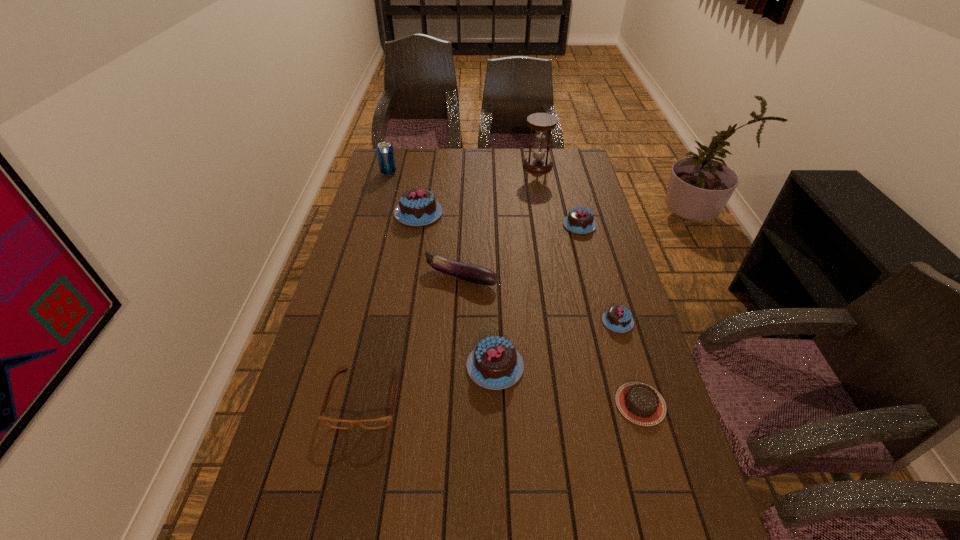
Locate an element on the screen. vacant space located 0.330m on the front of the fifth nearest object is located at coordinates (456, 384).

At what (x,y) coordinates should I click in order to perform the action: click on blank space located 0.200m on the front-facing side of the brown spectacles. Please return your answer as a coordinate pair (x, y). Looking at the image, I should click on (338, 527).

The height and width of the screenshot is (540, 960). I want to click on free point located 0.210m on the left of the third farthest chocolate cake, so click(x=529, y=321).

Find the location of a particular element. This screenshot has width=960, height=540. vacant space located 0.150m on the front of the shortest object is located at coordinates (666, 494).

This screenshot has width=960, height=540. Find the location of `hourglass that is at the far edge`. hourglass that is at the far edge is located at coordinates (541, 122).

Where is `beer can that is at the far edge`? The width and height of the screenshot is (960, 540). beer can that is at the far edge is located at coordinates (385, 153).

Where is `beer can that is positioned at the left edge`? This screenshot has width=960, height=540. beer can that is positioned at the left edge is located at coordinates (385, 153).

Where is `chocolate cake that is at the left edge`? This screenshot has height=540, width=960. chocolate cake that is at the left edge is located at coordinates (417, 207).

You are a GUI agent. You are given a task and a screenshot of the screen. Output one action in this format:
    pyautogui.click(x=<x>, y=<y>)
    Task: Click on the spectacles at the left edge
    The width and height of the screenshot is (960, 540).
    Given the screenshot: What is the action you would take?
    pyautogui.click(x=382, y=422)

Find the location of a particular element. The height and width of the screenshot is (540, 960). hourglass that is at the right edge is located at coordinates (541, 122).